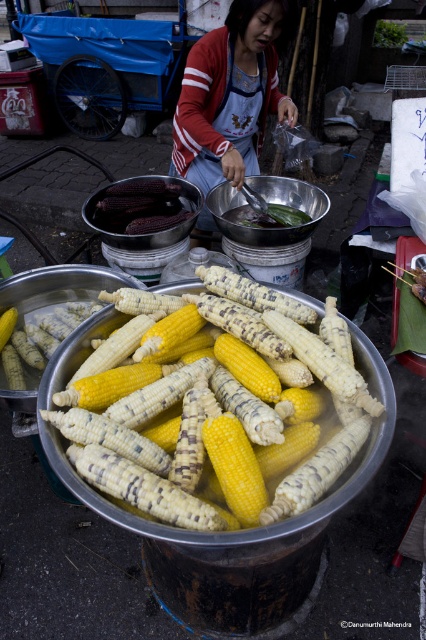
You are a customer at the market and want to know which item is higher in the image. The red and white striped sweater at center and the purple matte corn at center are both visible. Which one is positioned higher?

The red and white striped sweater at center is above the purple matte corn at center, so the red and white striped sweater at center is positioned higher.

You are a food inspector standing 2 meters away from the yellow matte corn at center and purple matte corn at center. Can you reach both corns with a 1.5 meter long inspection tool without moving closer?

The yellow matte corn at center is 1.14 meters from the purple matte corn at center. Since the distance between them is less than the 1.5 meter tool length, you can reach both corns with the tool without moving closer.

You are a food inspector standing at the edge of the vendor stall. You need to check the corn at the center. The safety regulations state that food must be at least 5 feet away from any clothing to prevent contamination. Are the yellow matte corn at center and the red and white striped sweater at center compliant with this regulation?

The distance between the yellow matte corn at center and the red and white striped sweater at center is 4.94 feet, which is less than the required 5 feet. Therefore, they are not compliant with the safety regulation.